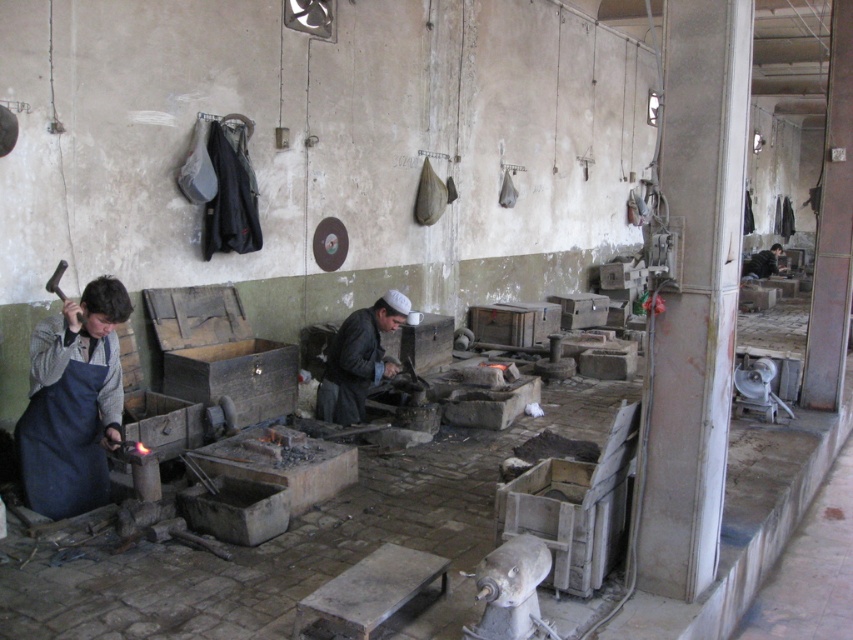
Based on the photo, you are organizing a workshop cleanup and need to place the blue apron at left and the dark blue apron at center into storage. Based on their positions in the image, which apron is located to the right of the other?

The dark blue apron at center is to the right of the blue apron at left.

You are organizing a workshop cleanup and need to place the dark gray leather jacket at center and the dark blue apron at center into storage. Given their sizes, which item should you choose to store first if you want to maximize the use of space?

The dark gray leather jacket at center occupies less space than the dark blue apron at center, so you should store the dark blue apron at center first to maximize space utilization.

You are standing in the workshop and need to reach both the dark gray leather jacket at center and the dark blue apron at center. Given that you can only move 10 meters, which item can you reach without exceeding your movement limit?

You can reach neither the dark gray leather jacket at center nor the dark blue apron at center because both are 11.32 meters away from each other, which exceeds your 10 meters movement limit.